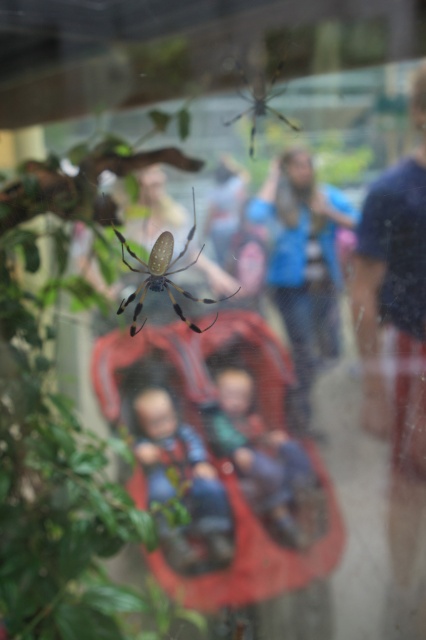
Is soft green fabric at center behind yellow and black silk spider at upper center?

Yes, soft green fabric at center is further from the viewer.

Measure the distance from soft green fabric at center to yellow and black silk spider at upper center.

soft green fabric at center and yellow and black silk spider at upper center are 25.33 inches apart.

You are a GUI agent. You are given a task and a screenshot of the screen. Output one action in this format:
    pyautogui.click(x=<x>, y=<y>)
    Task: Click on the soft green fabric at center
    This screenshot has width=426, height=640.
    Given the screenshot: What is the action you would take?
    pyautogui.click(x=261, y=456)

Identify the location of soft green fabric at center. The height and width of the screenshot is (640, 426). (261, 456).

Which is more to the left, shiny golden spider at center or yellow and black silk spider at upper center?

Positioned to the left is shiny golden spider at center.

Looking at this image, measure the distance from shiny golden spider at center to yellow and black silk spider at upper center.

shiny golden spider at center is 11.51 inches away from yellow and black silk spider at upper center.

Between point (149, 266) and point (282, 61), which one is positioned in front?

Point (282, 61) is more forward.

Find the location of a particular element. This screenshot has height=640, width=426. shiny golden spider at center is located at coordinates (161, 275).

Which is behind, point (321, 205) or point (160, 284)?

The point (160, 284) is behind.

Is point (348, 220) less distant than point (175, 260)?

Yes.

Measure the distance between point [310,384] and camera.

A distance of 4.68 feet exists between point [310,384] and camera.

The image size is (426, 640). Find the location of `blue fabric jacket at center`. blue fabric jacket at center is located at coordinates (304, 262).